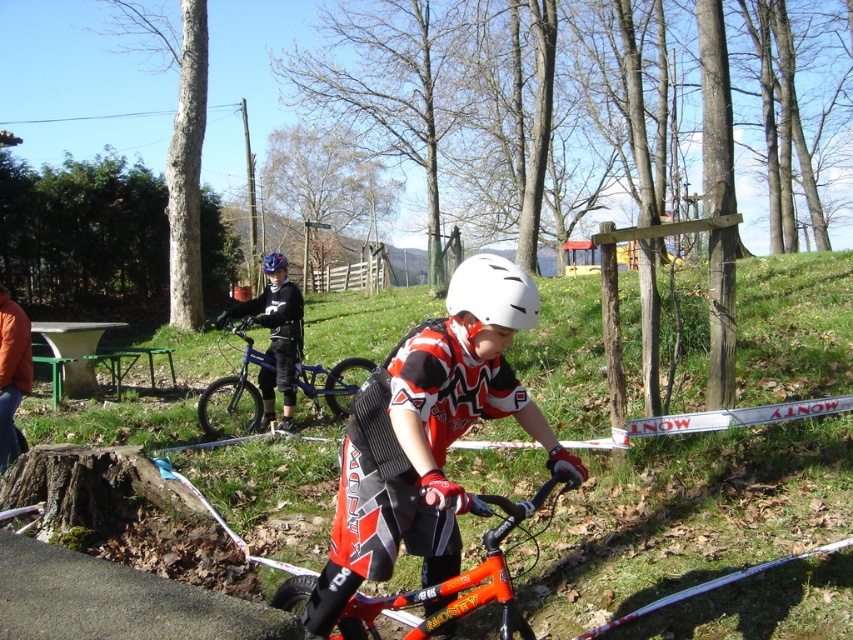
Does blue metallic bicycle at center come in front of white matte helmet at center?

No, it is not.

Who is higher up, blue metallic bicycle at center or white matte helmet at center?

white matte helmet at center

The width and height of the screenshot is (853, 640). Find the location of `blue metallic bicycle at center`. blue metallic bicycle at center is located at coordinates (235, 396).

This screenshot has width=853, height=640. What are the coordinates of `blue metallic bicycle at center` in the screenshot? It's located at (235, 396).

Between orange matte bicycle at center and blue matte helmet at center, which one is positioned higher?

blue matte helmet at center

This screenshot has height=640, width=853. What are the coordinates of `orange matte bicycle at center` in the screenshot? It's located at (427, 435).

Is point (454, 285) closer to viewer compared to point (271, 259)?

Yes, it is in front of point (271, 259).

Where is `orange matte bicycle at center`? orange matte bicycle at center is located at coordinates (427, 435).

Does blue metallic bicycle at center have a larger size compared to blue matte helmet at center?

No, blue metallic bicycle at center is not bigger than blue matte helmet at center.

Which of these two, blue metallic bicycle at center or blue matte helmet at center, stands shorter?

Standing shorter between the two is blue matte helmet at center.

Where is `blue metallic bicycle at center`? The image size is (853, 640). blue metallic bicycle at center is located at coordinates (235, 396).

Find the location of a particular element. Image resolution: width=853 pixels, height=640 pixels. blue metallic bicycle at center is located at coordinates (235, 396).